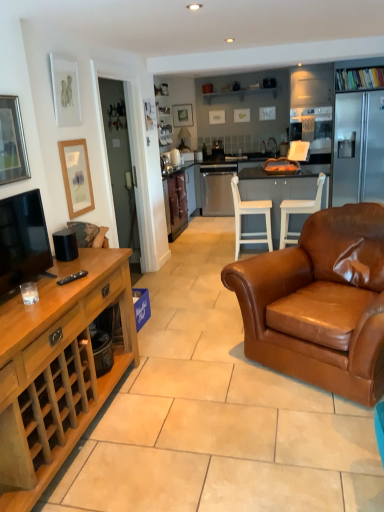
Question: Is matte wooden picture frame at left, acting as the 3th picture frame starting from the front, in front of or behind white glossy kettle at center in the image?

Choices:
 (A) front
 (B) behind

Answer: (A)

Question: From the image's perspective, is matte wooden picture frame at left, positioned as the fourth picture frame in top-to-bottom order, located above or below white glossy kettle at center?

Choices:
 (A) below
 (B) above

Answer: (A)

Question: Based on their relative distances, which object is farther from the matte white picture frame at upper left, positioned as the 3th picture frame in bottom-to-top order?

Choices:
 (A) brown leather armchair at center
 (B) white wood table at center
 (C) matte black picture frame at upper center, marked as the first picture frame in a right-to-left arrangement
 (D) white wood chair at center, the second chair from the right
 (E) wooden cabinet at left, placed as the first cabinetry when sorted from front to back

Answer: (C)

Question: Estimate the real-world distances between objects in this image. Which object is closer to the satin silver dishwasher at center?

Choices:
 (A) matte wooden picture frame at left, the 3th picture frame positioned from the left
 (B) brown leather armchair at center
 (C) silver-framed picture at upper left, the first picture frame in the left-to-right sequence
 (D) wooden cabinet at left, placed as the first cabinetry when sorted from front to back
 (E) matte black tv at left

Answer: (A)